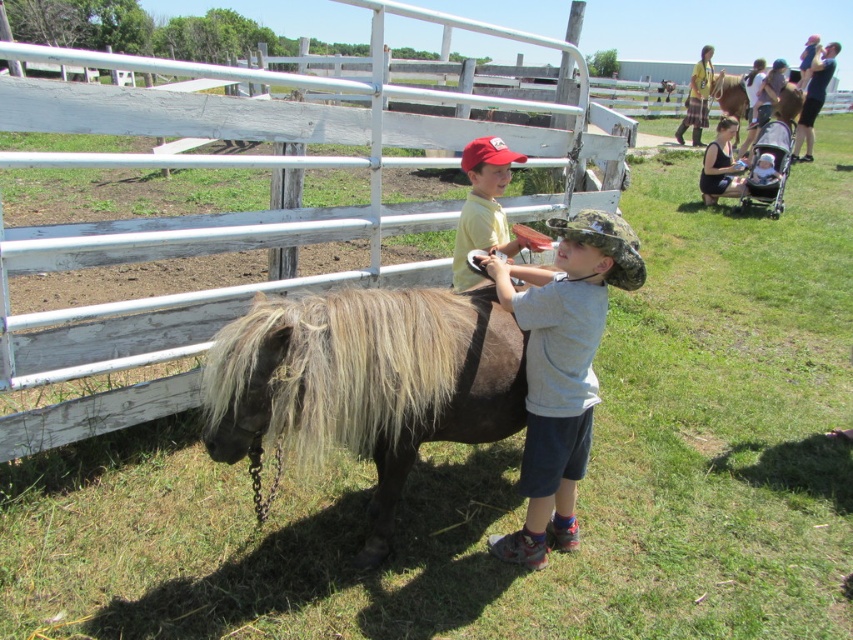
Question: Where is brown fuzzy pony at center located in relation to camouflage fabric hat at center in the image?

Choices:
 (A) above
 (B) below

Answer: (B)

Question: Observing the image, what is the correct spatial positioning of brown fuzzy pony at center in reference to camouflage fabric hat at center?

Choices:
 (A) below
 (B) above

Answer: (A)

Question: Which object is farther from the camera taking this photo?

Choices:
 (A) white wooden fence at center
 (B) camouflage fabric hat at center
 (C) matte yellow shirt at upper center

Answer: (A)

Question: Does brown fuzzy pony at center have a smaller size compared to camouflage fabric hat at center?

Choices:
 (A) no
 (B) yes

Answer: (A)

Question: Among these points, which one is farthest from the camera?

Choices:
 (A) coord(492,188)
 (B) coord(213,388)
 (C) coord(405,10)
 (D) coord(567,380)

Answer: (C)

Question: Which point is closer to the camera?

Choices:
 (A) matte yellow shirt at upper center
 (B) brown fuzzy pony at center

Answer: (B)